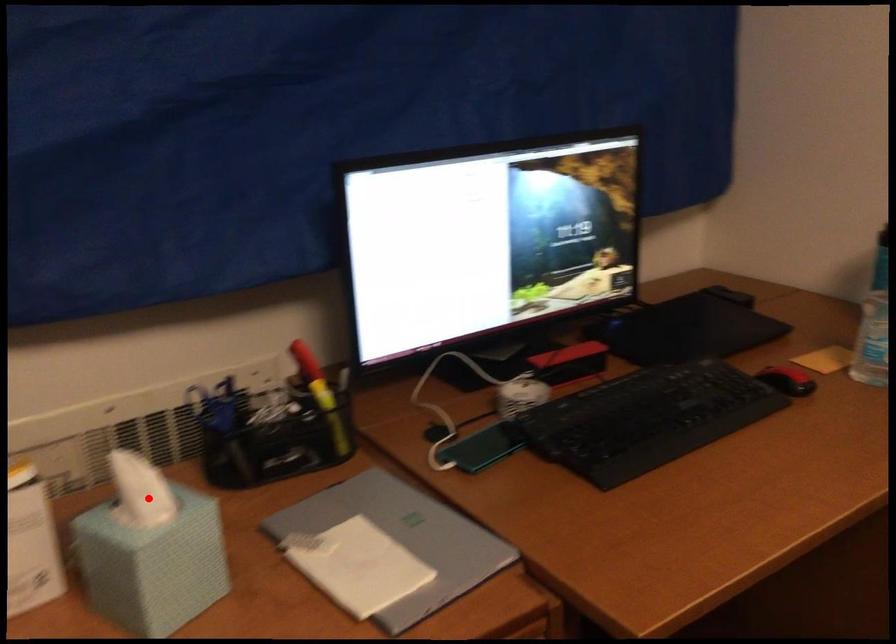
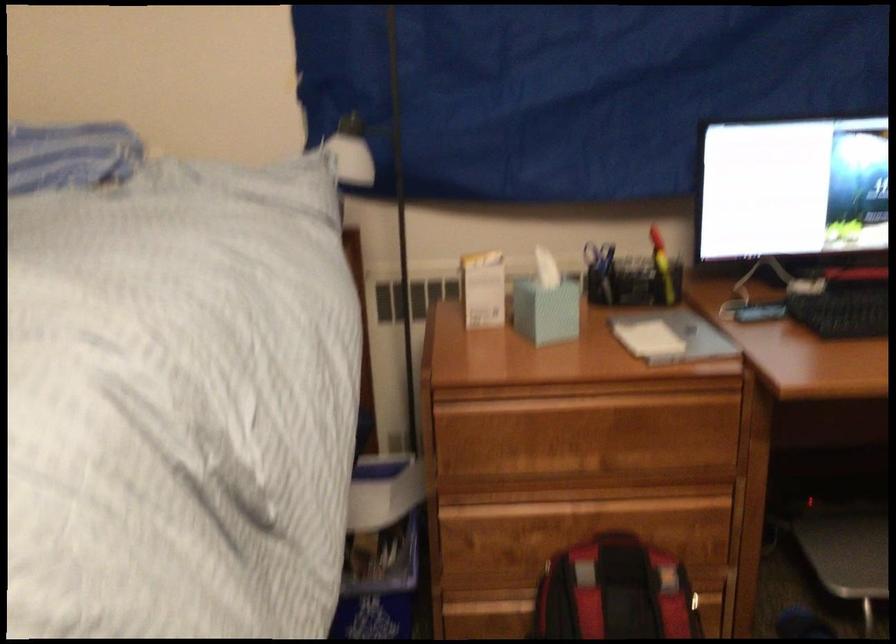
Locate, in the second image, the point that corresponds to the highlighted location in the first image.

(545, 270)